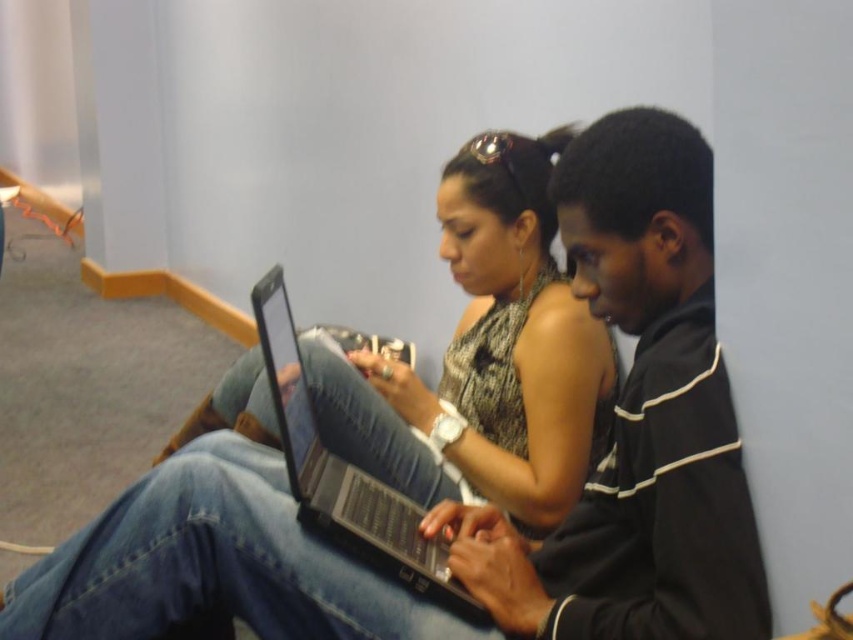
Question: Where is matte black laptop at center located in relation to black matte laptop at center in the image?

Choices:
 (A) right
 (B) left

Answer: (B)

Question: Can you confirm if matte black laptop at center is wider than black matte laptop at center?

Choices:
 (A) no
 (B) yes

Answer: (B)

Question: Which point is closer to the camera?

Choices:
 (A) (288, 465)
 (B) (329, 349)

Answer: (A)

Question: Is matte black laptop at center above black matte laptop at center?

Choices:
 (A) yes
 (B) no

Answer: (A)

Question: Among these objects, which one is farthest from the camera?

Choices:
 (A) black matte laptop at center
 (B) matte black laptop at center

Answer: (B)

Question: Which point appears farthest from the camera in this image?

Choices:
 (A) (292, 419)
 (B) (450, 388)

Answer: (B)